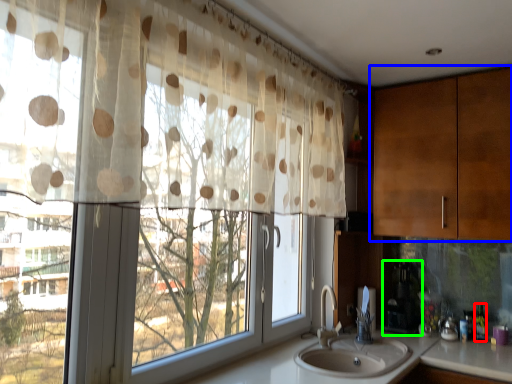
Question: Which object is the farthest from bottle (highlighted by a red box)? Choose among these: cabinetry (highlighted by a blue box) or appliance (highlighted by a green box).

Choices:
 (A) cabinetry
 (B) appliance

Answer: (A)